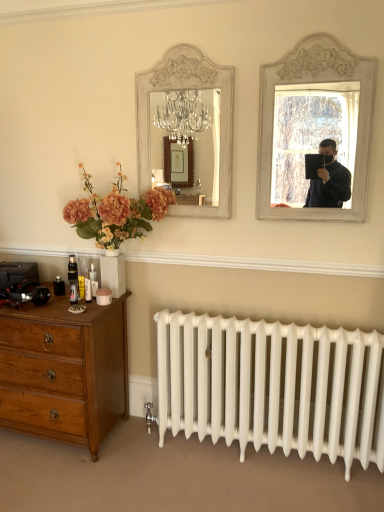
Identify the location of vacant space underneath white painted wood mirror at upper center (from a real-world perspective). (179, 247).